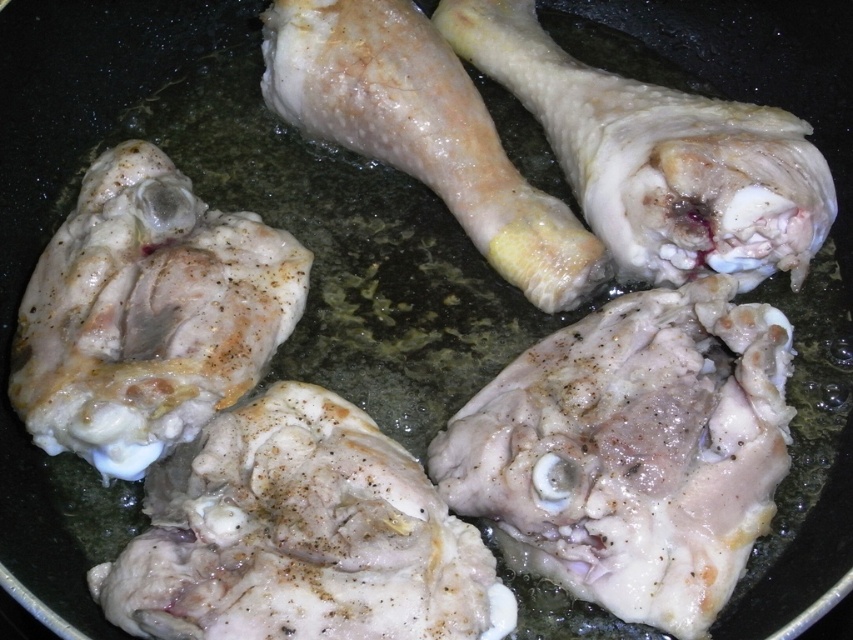
You are a chef trying to flip the white matte chicken thigh at center in the frying pan. Based on its current position, which direction should you move the spatula to flip it so that it lands back in the pan?

The white matte chicken thigh at center is located at point coordinates, so you should move the spatula in a upward direction to flip it so that it lands back in the pan.

You are a chef preparing a dish and need to flip the chicken thighs in the pan. Which chicken thigh should you flip first to ensure even cooking? The white matte chicken thigh at center and the white matte chicken thigh at lower left are both in the pan.

You should flip the white matte chicken thigh at center first because it is positioned under the white matte chicken thigh at lower left, meaning it might be cooking unevenly due to its placement beneath the other thigh.